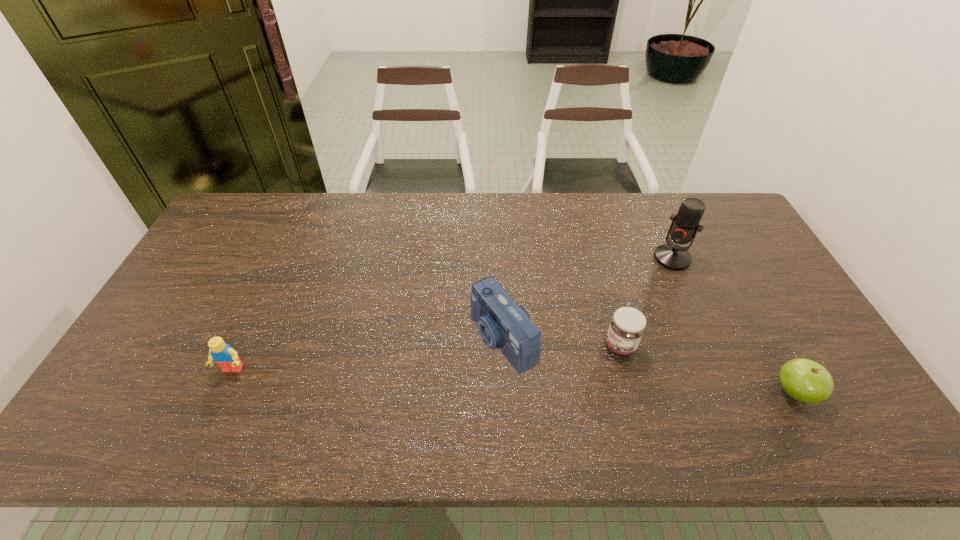
The image size is (960, 540). Find the location of `vacant space located 0.260m on the side of the microphone with the red ring`. vacant space located 0.260m on the side of the microphone with the red ring is located at coordinates (625, 316).

Where is `free region located 0.240m on the front label of the third object from right to left`? The height and width of the screenshot is (540, 960). free region located 0.240m on the front label of the third object from right to left is located at coordinates (532, 394).

This screenshot has width=960, height=540. In order to click on vacant region located on the front label of the third object from right to left in this screenshot , I will do `click(541, 388)`.

Where is `vacant area located 0.080m on the front label of the third object from right to left`? vacant area located 0.080m on the front label of the third object from right to left is located at coordinates (584, 366).

Locate an element on the screen. The height and width of the screenshot is (540, 960). vacant space positioned 0.150m on the lens of the fourth object from right to left is located at coordinates (423, 383).

Where is `vacant space located on the lens of the fourth object from right to left`? vacant space located on the lens of the fourth object from right to left is located at coordinates (397, 396).

The image size is (960, 540). In order to click on free space located 0.150m on the lens of the fourth object from right to left in this screenshot , I will do `click(423, 383)`.

This screenshot has height=540, width=960. I want to click on Lego present at the near edge, so click(224, 355).

You are a GUI agent. You are given a task and a screenshot of the screen. Output one action in this format:
    pyautogui.click(x=<x>, y=<y>)
    Task: Click on the apple at the near edge
    The height and width of the screenshot is (540, 960).
    Given the screenshot: What is the action you would take?
    pyautogui.click(x=805, y=380)

The height and width of the screenshot is (540, 960). Find the location of `camera located at the near edge`. camera located at the near edge is located at coordinates (501, 323).